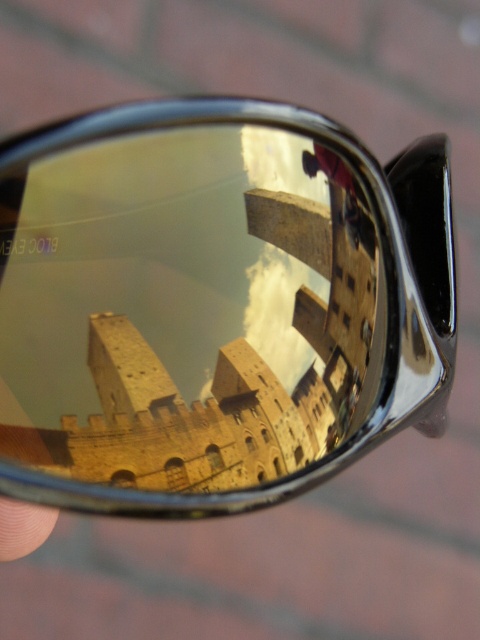
What are the coordinates of the shiny metallic sunglasses at center?

The shiny metallic sunglasses at center is located at point (215, 305).

You are trying to determine if the shiny metallic sunglasses at center will fit into a small storage case that can only accommodate items smaller than the skinsmoothhand at lower left. Based on the scene, will the sunglasses fit?

The shiny metallic sunglasses at center has a larger size compared to skinsmoothhand at lower left, so the sunglasses will not fit into the storage case designed for items smaller than the skinsmoothhand at lower left.